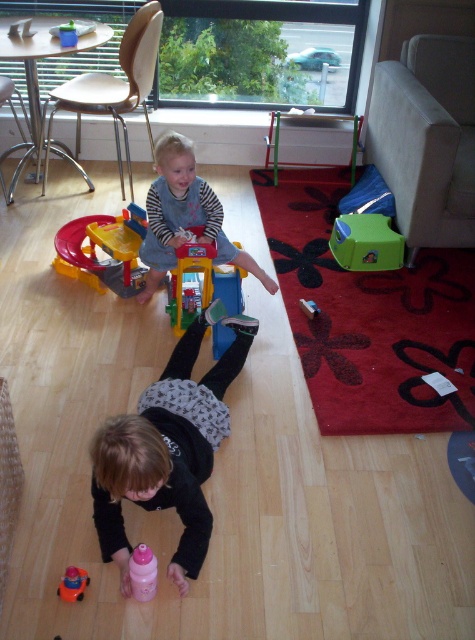
Question: Which point is farther to the camera?

Choices:
 (A) (145, 243)
 (B) (148, 548)
 (C) (86, 266)
 (D) (372, 228)

Answer: (D)

Question: Which object is positioned farthest from the rubberized plastic toy car at center?

Choices:
 (A) matte striped shirt at center
 (B) black matte shirt at lower center

Answer: (B)

Question: Is matte striped shirt at center further to camera compared to rubberized plastic toy car at center?

Choices:
 (A) yes
 (B) no

Answer: (B)

Question: Is green plastic toy at lower right bigger than pink plastic bottle at lower center?

Choices:
 (A) yes
 (B) no

Answer: (A)

Question: Does matte striped shirt at center appear over green plastic toy at lower right?

Choices:
 (A) yes
 (B) no

Answer: (B)

Question: Among these points, which one is farthest from the camera?

Choices:
 (A) (176, 449)
 (B) (188, 202)
 (C) (361, 218)
 (D) (141, 600)

Answer: (C)